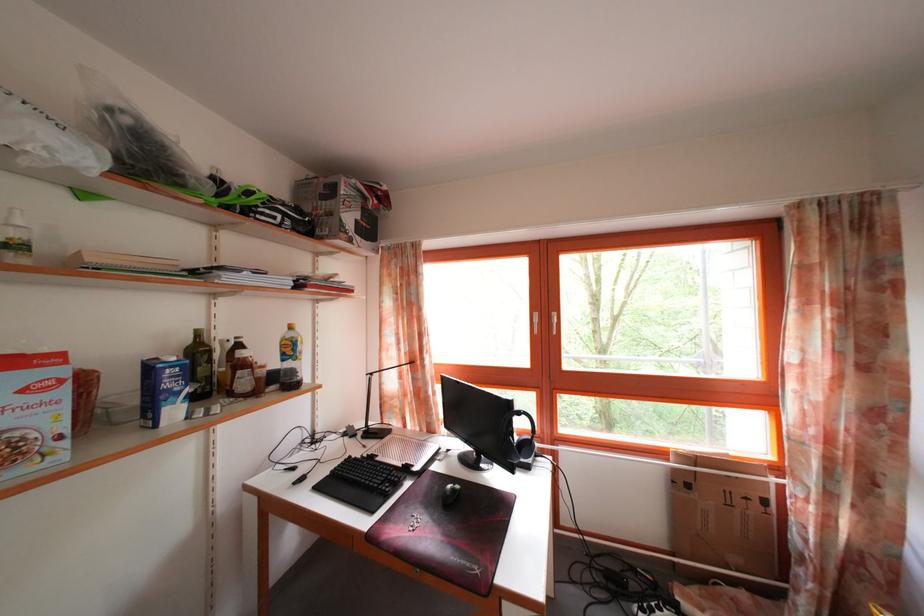
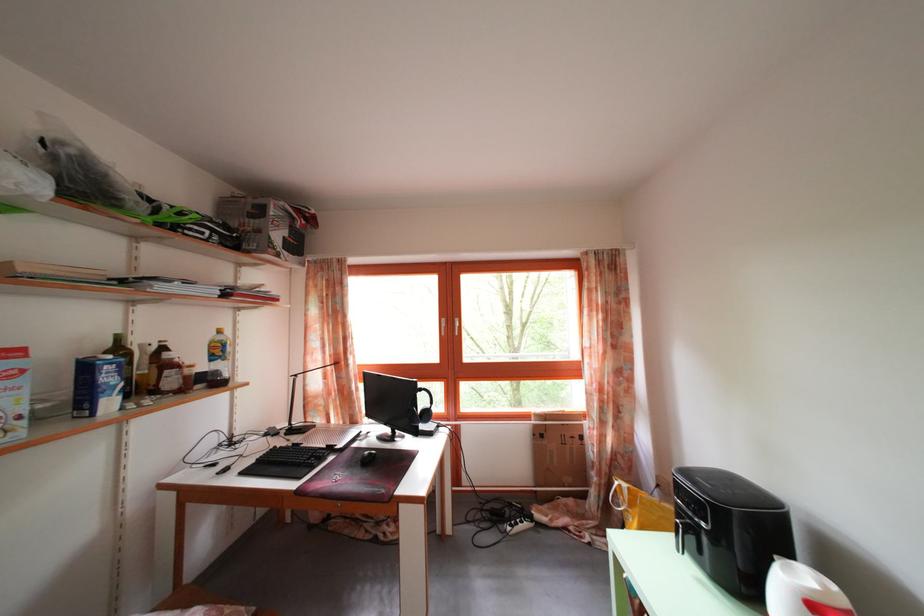
In the second image, find the point that corresponds to point (297, 358) in the first image.

(225, 359)